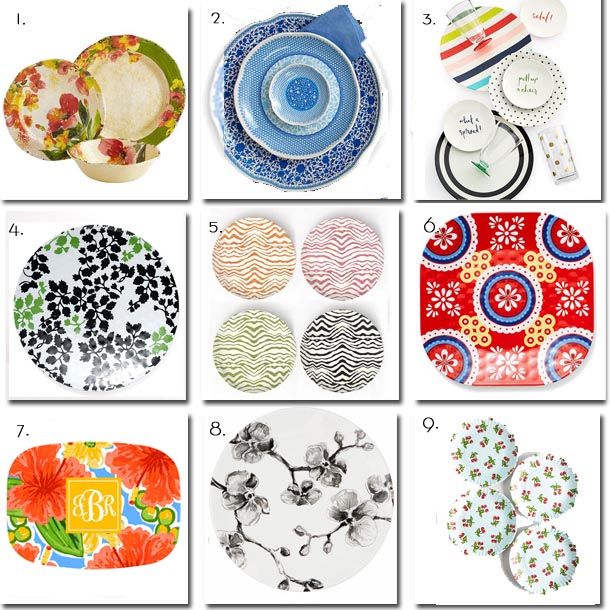
Find the location of a particular element. The width and height of the screenshot is (610, 610). black plate with zigzags is located at coordinates (334, 363).